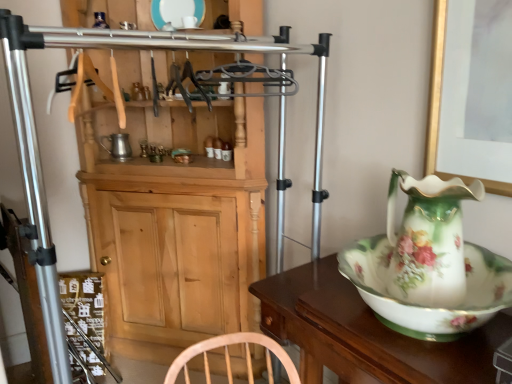
Question: Is porcelain plate at upper center thinner than white glossy bowl at right?

Choices:
 (A) no
 (B) yes

Answer: (B)

Question: Considering the relative sizes of porcelain plate at upper center and white glossy bowl at right in the image provided, is porcelain plate at upper center smaller than white glossy bowl at right?

Choices:
 (A) yes
 (B) no

Answer: (A)

Question: From a real-world perspective, is porcelain plate at upper center located beneath white glossy bowl at right?

Choices:
 (A) yes
 (B) no

Answer: (B)

Question: Are porcelain plate at upper center and white glossy bowl at right far apart?

Choices:
 (A) no
 (B) yes

Answer: (B)

Question: Does porcelain plate at upper center have a lesser height compared to white glossy bowl at right?

Choices:
 (A) no
 (B) yes

Answer: (B)

Question: From the image's perspective, relative to white glossy bowl at right, is porcelain plate at upper center above or below?

Choices:
 (A) below
 (B) above

Answer: (B)

Question: Is porcelain plate at upper center taller or shorter than white glossy bowl at right?

Choices:
 (A) tall
 (B) short

Answer: (B)

Question: Considering their positions, is porcelain plate at upper center located in front of or behind white glossy bowl at right?

Choices:
 (A) front
 (B) behind

Answer: (B)

Question: From a real-world perspective, relative to white glossy bowl at right, is porcelain plate at upper center vertically above or below?

Choices:
 (A) above
 (B) below

Answer: (A)

Question: Is porcelain floral jug at right bigger or smaller than wooden cabinet at center?

Choices:
 (A) small
 (B) big

Answer: (A)

Question: Choose the correct answer: Is porcelain floral jug at right inside wooden cabinet at center or outside it?

Choices:
 (A) inside
 (B) outside

Answer: (B)

Question: Does point (409, 225) appear closer or farther from the camera than point (201, 62)?

Choices:
 (A) farther
 (B) closer

Answer: (B)

Question: Considering the positions of porcelain floral jug at right and wooden cabinet at center in the image, is porcelain floral jug at right taller or shorter than wooden cabinet at center?

Choices:
 (A) short
 (B) tall

Answer: (A)

Question: Considering the positions of wooden cabinet at center and porcelain floral jug at right in the image, is wooden cabinet at center taller or shorter than porcelain floral jug at right?

Choices:
 (A) tall
 (B) short

Answer: (A)

Question: In the image, is wooden cabinet at center on the left side or the right side of porcelain floral jug at right?

Choices:
 (A) left
 (B) right

Answer: (A)